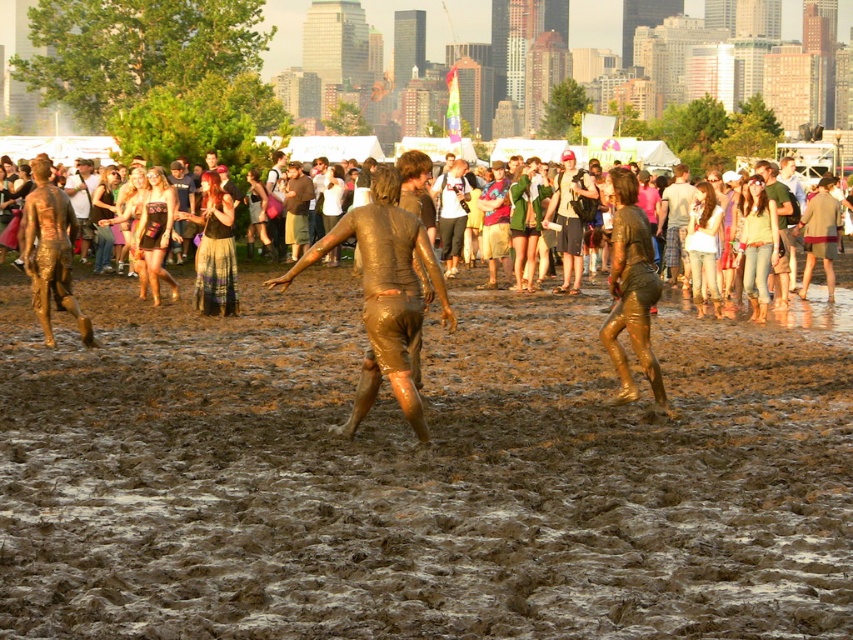
Question: Considering the relative positions of matte black dress at center and denim shorts at center in the image provided, where is matte black dress at center located with respect to denim shorts at center?

Choices:
 (A) right
 (B) left

Answer: (B)

Question: Is muddy wet ground at center positioned at the back of denim shorts at center?

Choices:
 (A) no
 (B) yes

Answer: (A)

Question: Among these points, which one is farthest from the camera?

Choices:
 (A) (785, 291)
 (B) (173, 252)

Answer: (B)

Question: Among these points, which one is nearest to the camera?

Choices:
 (A) (421, 243)
 (B) (683, 260)
 (C) (775, 205)
 (D) (184, 211)

Answer: (A)

Question: Does muddy skin at center have a smaller size compared to brown leather jacket at center?

Choices:
 (A) no
 (B) yes

Answer: (A)

Question: Which of the following is the closest to the observer?

Choices:
 (A) (398, 230)
 (B) (178, 173)
 (C) (851, 432)
 (D) (659, 384)

Answer: (A)